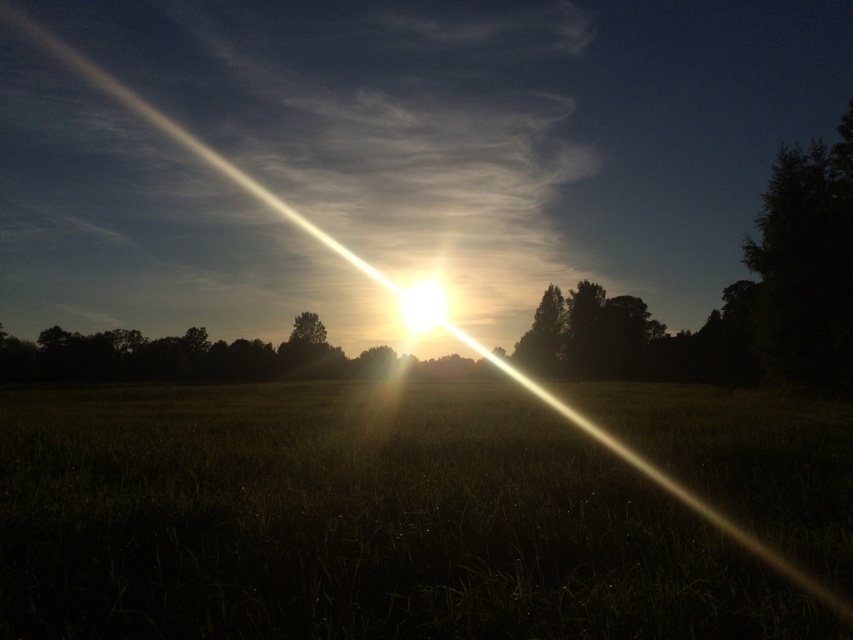
You are a photographer trying to capture the sunset scene. You want to ensure that both the green matte grass at center and the green leafy tree at center are visible in your photo. Based on their heights, which object will appear taller in the final image?

The green leafy tree at center will appear taller in the final image because it is taller than the green matte grass at center.

You are a photographer trying to capture the entire scene in one shot. Considering the green matte grass at center and the green leafy tree at center, which one will appear smaller in the photo?

The green matte grass at center occupies less space than the green leafy tree at center, so it will appear smaller in the photo.